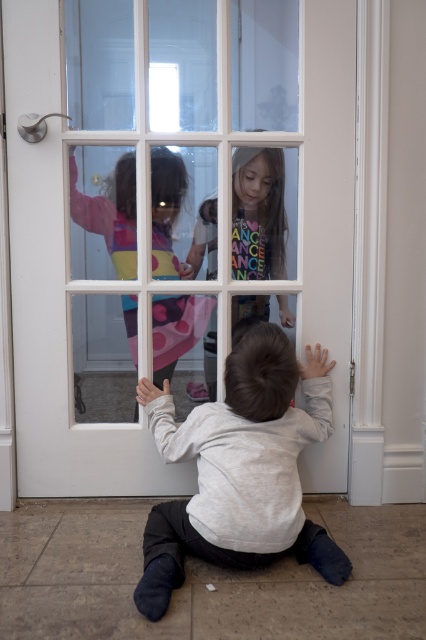
Question: Which of these objects is positioned closest to the gray cotton shirt at lower center?

Choices:
 (A) matte pink dress at upper center
 (B) light gray cotton shirt at center
 (C) white glass door at center

Answer: (C)

Question: Observing the image, what is the correct spatial positioning of white glass door at center in reference to matte pink dress at upper center?

Choices:
 (A) right
 (B) left

Answer: (A)

Question: Which is nearer to the gray cotton shirt at lower center?

Choices:
 (A) matte pink dress at upper center
 (B) white glass door at center
 (C) light gray cotton shirt at center

Answer: (B)

Question: Does white glass door at center appear on the left side of light gray cotton shirt at center?

Choices:
 (A) no
 (B) yes

Answer: (B)

Question: Among these objects, which one is farthest from the camera?

Choices:
 (A) gray cotton shirt at lower center
 (B) white glass door at center

Answer: (B)

Question: Can you confirm if white glass door at center is positioned below light gray cotton shirt at center?

Choices:
 (A) no
 (B) yes

Answer: (A)